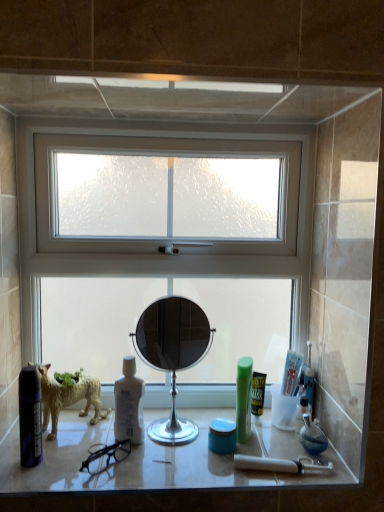
Image resolution: width=384 pixels, height=512 pixels. I want to click on vacant space in front of green plastic mouthwash at right, the 1th mouthwash in the right-to-left sequence, so click(267, 474).